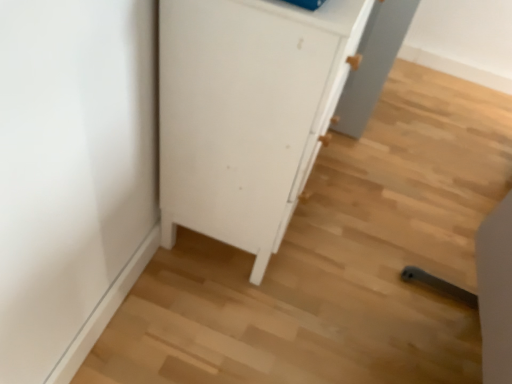
The width and height of the screenshot is (512, 384). In order to click on vacant space behind light wood chair at lower right in this screenshot , I will do `click(399, 227)`.